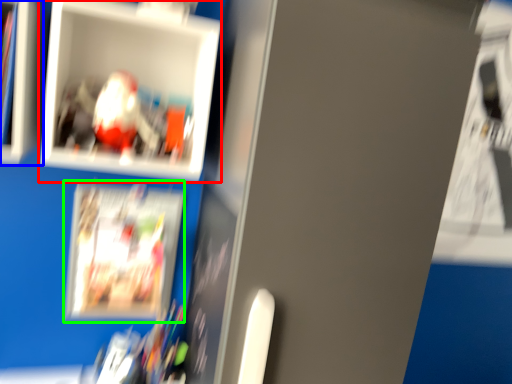
Question: Considering the real-world distances, which object is closest to picture frame (highlighted by a red box)? cabinet (highlighted by a blue box) or magazine (highlighted by a green box).

Choices:
 (A) cabinet
 (B) magazine

Answer: (A)